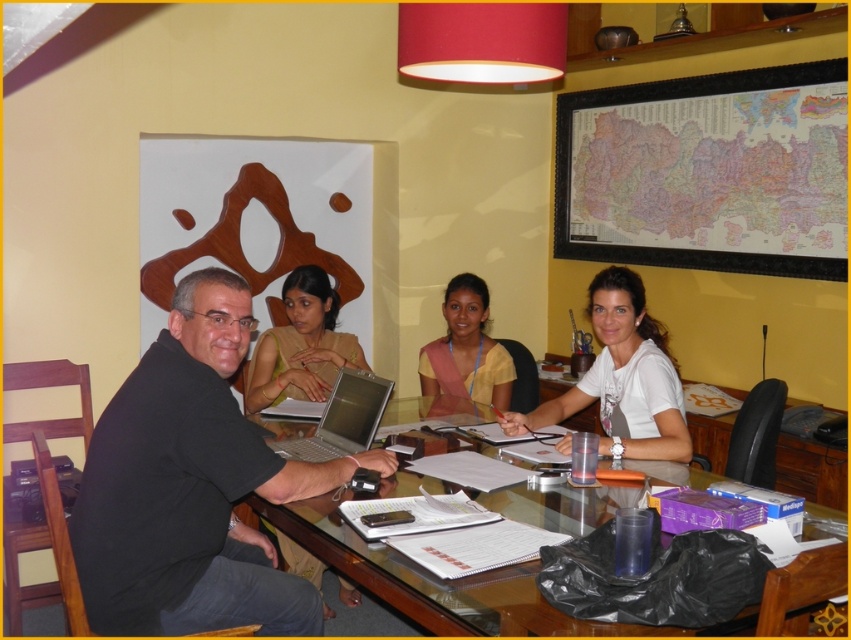
You are organizing a small event and need to know if the black matte shirt at center can be placed on the transparent glass table at center without covering the entire surface. Based on their sizes, what do you think?

The black matte shirt at center is smaller than the transparent glass table at center, so it can be placed on the table without covering the entire surface.

You are standing at the entrance of the room and want to greet the person wearing the white matte shirt at center. Based on their position coordinates, in which direction should you walk to reach them?

The white matte shirt at center is located at coordinates point (621, 378), so you should walk towards the center of the room to reach them.

You are sitting at the glass table in the meeting room. You notice two points marked on the table. Which point, point (558, 413) or point (337, 403), is closer to you?

Point (558, 413) is closer to you because it is further to the viewer than point (337, 403).